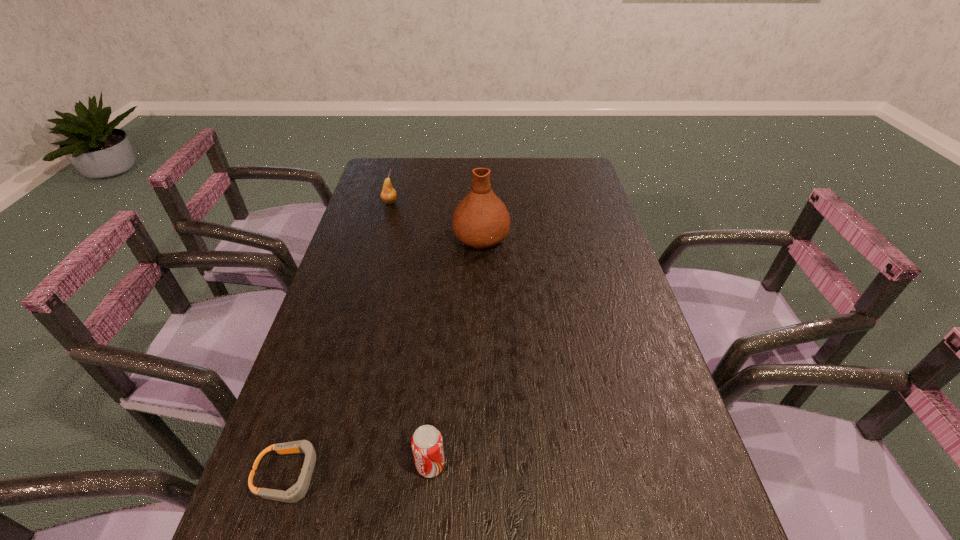
At what (x,y) coordinates should I click in order to perform the action: click on free point located on the front and back of the goggles. Please return your answer as a coordinate pair (x, y). Image resolution: width=960 pixels, height=540 pixels. Looking at the image, I should click on (401, 476).

Where is `pear that is at the left edge`? This screenshot has width=960, height=540. pear that is at the left edge is located at coordinates (388, 195).

I want to click on goggles at the left edge, so click(295, 493).

Identify the location of free space at the far edge. The image size is (960, 540). (443, 186).

This screenshot has width=960, height=540. I want to click on vacant region at the left edge of the desktop, so click(x=315, y=357).

You are a GUI agent. You are given a task and a screenshot of the screen. Output one action in this format:
    pyautogui.click(x=<x>, y=<y>)
    Task: Click on the free space at the right edge of the desktop
    The width and height of the screenshot is (960, 540).
    Given the screenshot: What is the action you would take?
    pyautogui.click(x=630, y=402)

Locate an element on the screen. The image size is (960, 540). empty space between the shortest object and the tallest object is located at coordinates (385, 356).

You are a GUI agent. You are given a task and a screenshot of the screen. Output one action in this format:
    pyautogui.click(x=<x>, y=<y>)
    Task: Click on the unoccupied area between the shortest object and the pitcher
    Image resolution: width=960 pixels, height=540 pixels.
    Given the screenshot: What is the action you would take?
    pyautogui.click(x=385, y=356)

What are the coordinates of `vacant area that lies between the second farthest object and the pear` in the screenshot? It's located at tap(436, 220).

Identify the location of vacant area that lies between the soda can and the tallest object. The height and width of the screenshot is (540, 960). (456, 351).